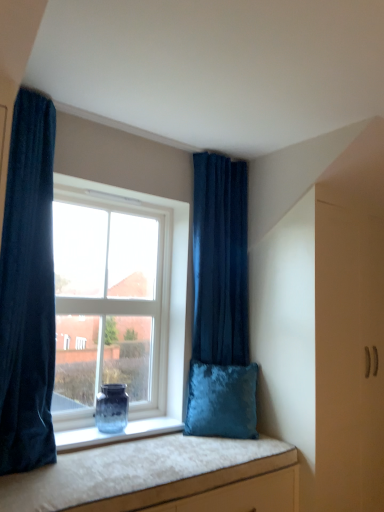
The height and width of the screenshot is (512, 384). What are the coordinates of `free spot above velvet dark blue curtain at left, arranged as the 1th curtain when viewed from the left (from a real-world perspective)` in the screenshot? It's located at (55, 85).